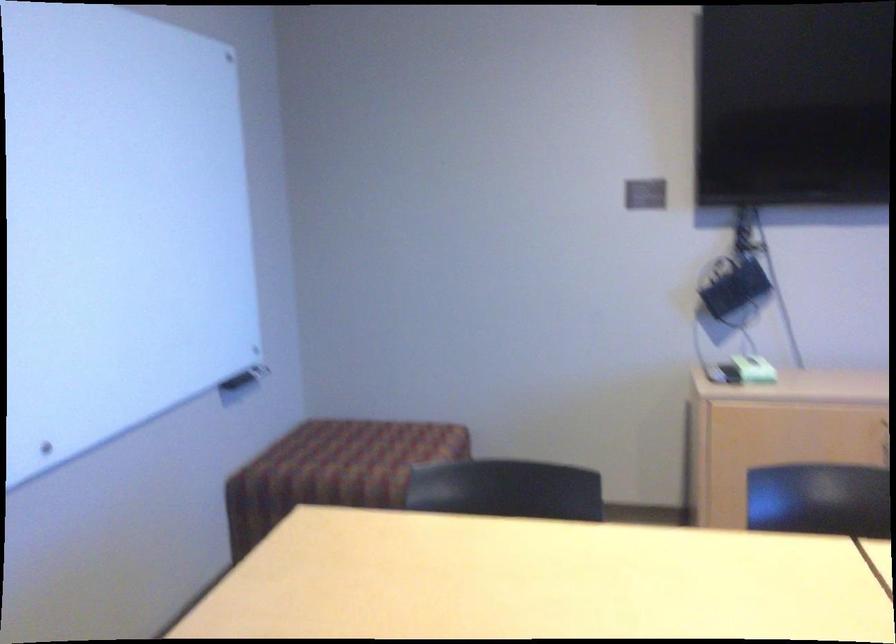
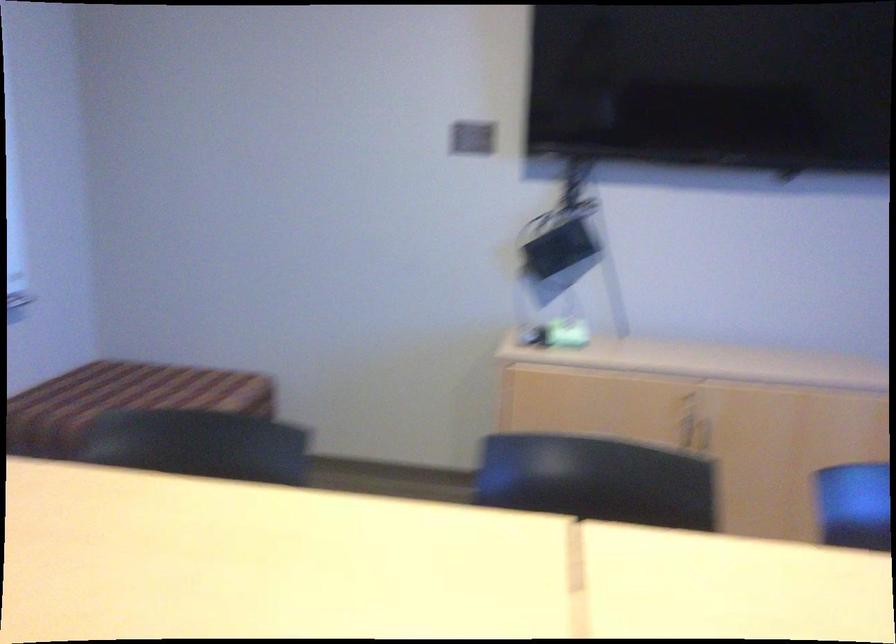
Question: The first image is from the beginning of the video and the second image is from the end. How did the camera likely rotate when shooting the video?

Choices:
 (A) Left
 (B) Right
 (C) Up
 (D) Down

Answer: (B)